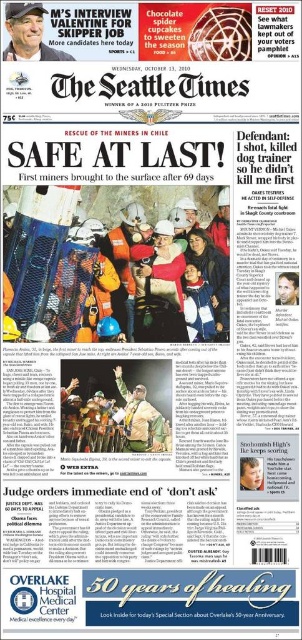
Question: Is hard hat helmet at center below matte black cap at upper left?

Choices:
 (A) yes
 (B) no

Answer: (A)

Question: Which point appears closest to the camera in this image?

Choices:
 (A) (244, 460)
 (B) (32, 20)
 (C) (127, 448)

Answer: (B)

Question: Can you confirm if hard hat helmet at center is thinner than matte black cap at upper left?

Choices:
 (A) yes
 (B) no

Answer: (B)

Question: Can you confirm if hard hat helmet at center is smaller than smooth skin face at center right?

Choices:
 (A) yes
 (B) no

Answer: (B)

Question: Which object is the farthest from the smooth skin face at center right?

Choices:
 (A) matte black cap at upper left
 (B) hard hat helmet at center

Answer: (A)

Question: Which point appears farthest from the camera in this image?

Choices:
 (A) (250, 484)
 (B) (44, 58)
 (C) (141, 438)

Answer: (A)